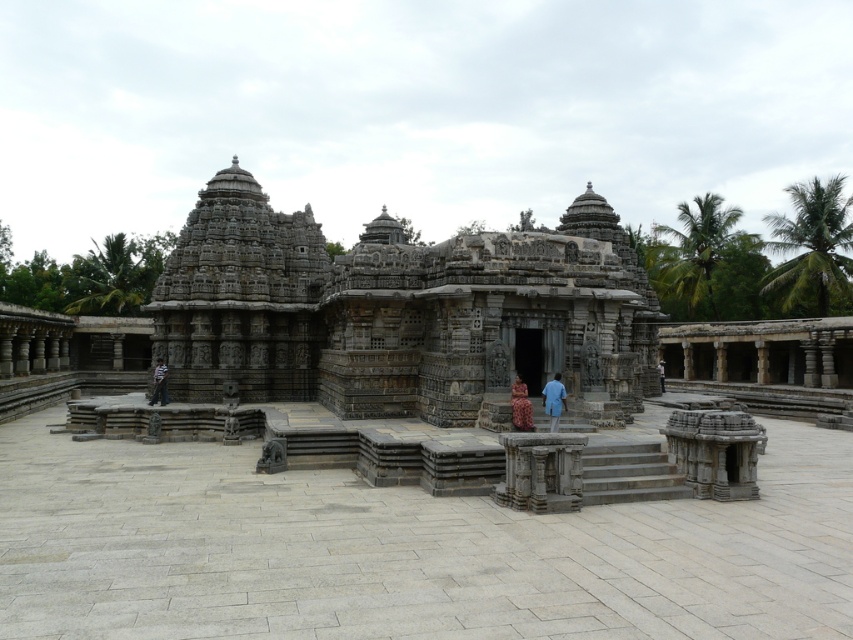
Question: Which point is farther to the camera?

Choices:
 (A) dark blue fabric at lower left
 (B) light blue fabric at center
 (C) matte brown dress at center

Answer: (B)

Question: Is gray stone hindu temple at center smaller than blue cotton shirt at center?

Choices:
 (A) yes
 (B) no

Answer: (B)

Question: Which point is farther from the camera taking this photo?

Choices:
 (A) (662, 381)
 (B) (553, 403)
 (C) (161, 365)

Answer: (A)

Question: Estimate the real-world distances between objects in this image. Which object is farther from the light blue fabric at center?

Choices:
 (A) matte brown dress at center
 (B) gray stone hindu temple at center

Answer: (A)

Question: Is gray stone hindu temple at center to the left of blue cotton shirt at center from the viewer's perspective?

Choices:
 (A) no
 (B) yes

Answer: (B)

Question: Can you confirm if gray stone hindu temple at center is smaller than blue cotton shirt at center?

Choices:
 (A) no
 (B) yes

Answer: (A)